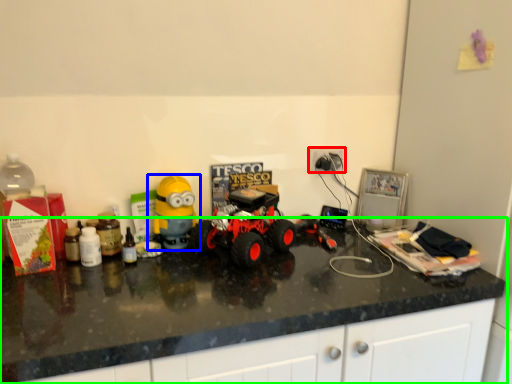
Question: Which object is the closest to the electric outlet (highlighted by a red box)? Choose among these: toy (highlighted by a blue box) or countertop (highlighted by a green box).

Choices:
 (A) toy
 (B) countertop

Answer: (A)